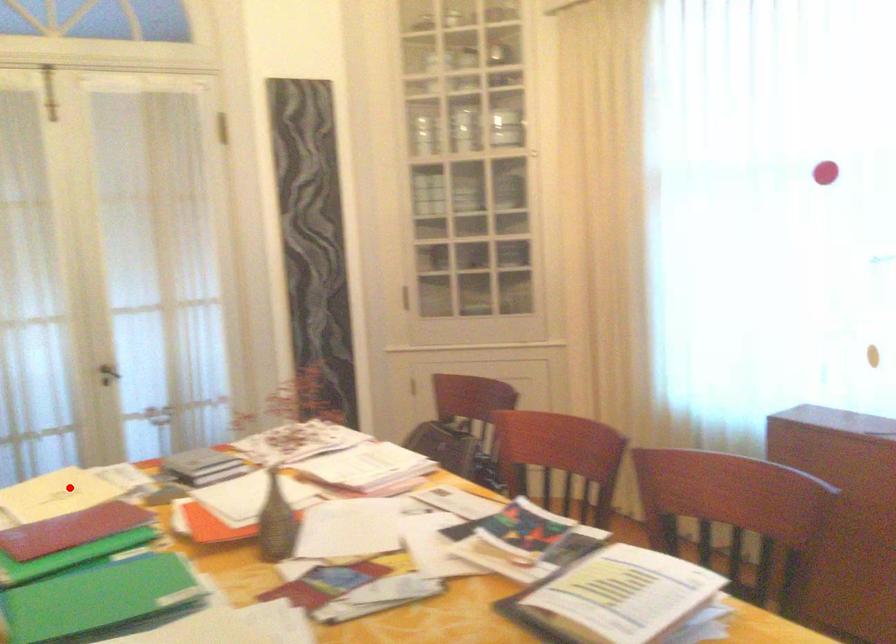
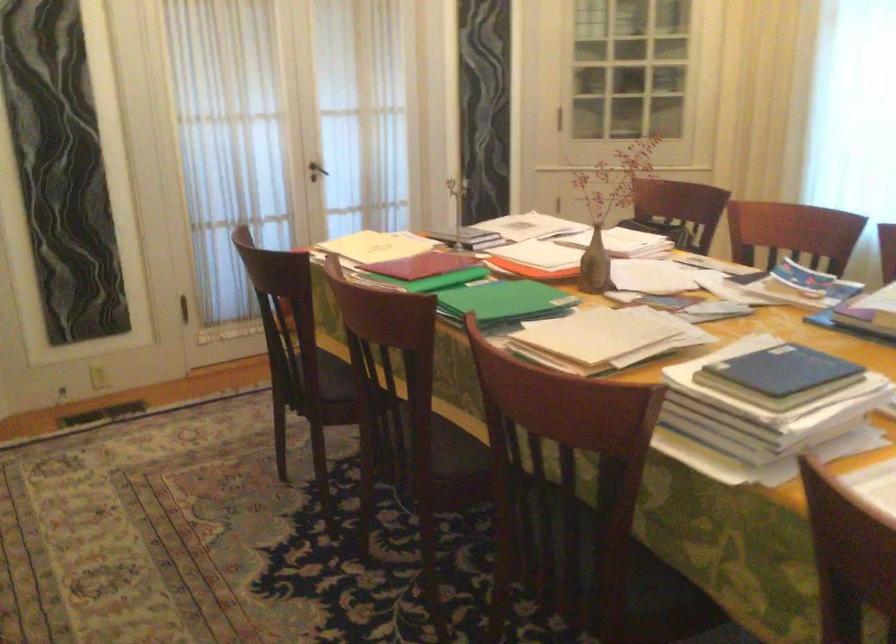
Question: I am providing you with two images of the same scene from different viewpoints. In image1, a red point is highlighted. Considering the same 3D point in image2, which of the following is correct?

Choices:
 (A) It is closer
 (B) It is farther

Answer: (B)